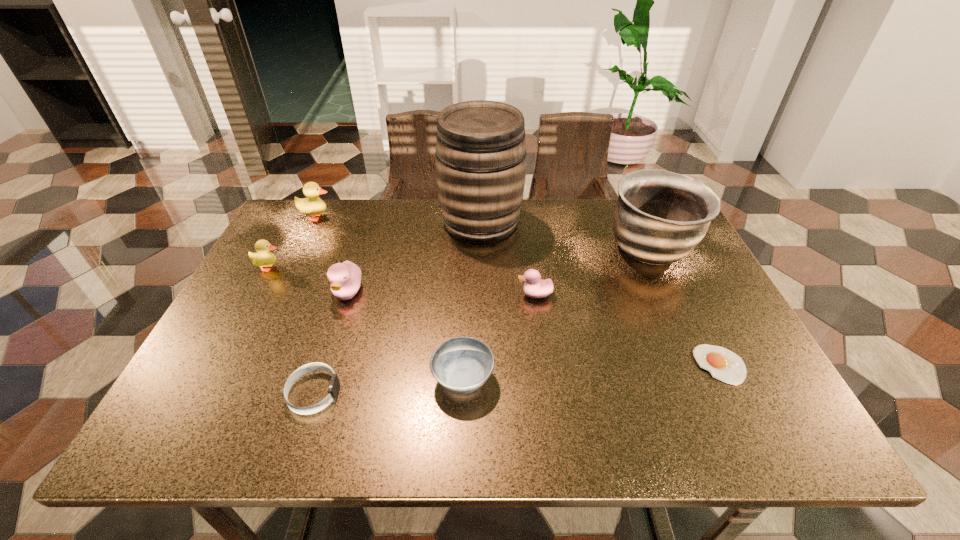
What are the coordinates of `vacant space located 0.350m on the front-facing side of the rightmost duckling` in the screenshot? It's located at (379, 294).

You are a GUI agent. You are given a task and a screenshot of the screen. Output one action in this format:
    pyautogui.click(x=<x>, y=<y>)
    Task: Click on the vacant area situated on the right of the seventh tallest object
    
    Given the screenshot: What is the action you would take?
    pyautogui.click(x=632, y=379)

This screenshot has width=960, height=540. Find the location of `vacant region located on the outer surface of the wristband`. vacant region located on the outer surface of the wristband is located at coordinates (363, 393).

Find the location of a particular element. This screenshot has width=960, height=540. vacant region located on the back of the egg yolk is located at coordinates (673, 270).

The height and width of the screenshot is (540, 960). Identify the location of wine bucket that is positioned at the far edge. (480, 152).

This screenshot has height=540, width=960. I want to click on pottery present at the far edge, so click(660, 216).

You are a GUI agent. You are given a task and a screenshot of the screen. Output one action in this format:
    pyautogui.click(x=<x>, y=<y>)
    Task: Click on the duckling that is at the far edge
    
    Given the screenshot: What is the action you would take?
    pyautogui.click(x=313, y=205)

I want to click on ashtray present at the near edge, so coord(462,365).

The height and width of the screenshot is (540, 960). What are the coordinates of `wristband at the near edge` in the screenshot? It's located at (334, 385).

Find the location of a particular element. The height and width of the screenshot is (540, 960). pottery positioned at the right edge is located at coordinates (660, 216).